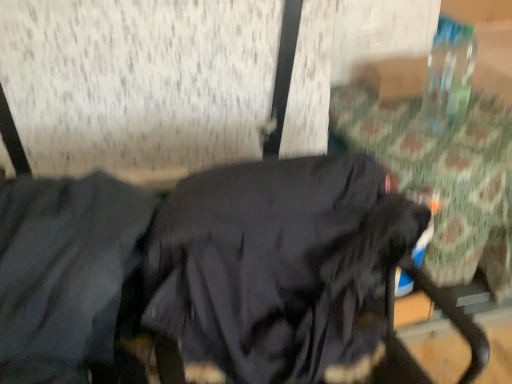
Question: Is point (252, 365) positioned closer to the camera than point (110, 249)?

Choices:
 (A) closer
 (B) farther

Answer: (B)

Question: From the image's perspective, is black matte sweatshirt at center positioned above or below dark gray fabric jacket at left?

Choices:
 (A) above
 (B) below

Answer: (B)

Question: In the image, is black matte sweatshirt at center on the left side or the right side of dark gray fabric jacket at left?

Choices:
 (A) right
 (B) left

Answer: (A)

Question: From the image's perspective, relative to black matte sweatshirt at center, is dark gray fabric jacket at left above or below?

Choices:
 (A) above
 (B) below

Answer: (A)

Question: From their relative heights in the image, would you say dark gray fabric jacket at left is taller or shorter than black matte sweatshirt at center?

Choices:
 (A) tall
 (B) short

Answer: (B)

Question: Choose the correct answer: Is dark gray fabric jacket at left inside black matte sweatshirt at center or outside it?

Choices:
 (A) inside
 (B) outside

Answer: (B)

Question: From a real-world perspective, is dark gray fabric jacket at left physically located above or below black matte sweatshirt at center?

Choices:
 (A) above
 (B) below

Answer: (A)